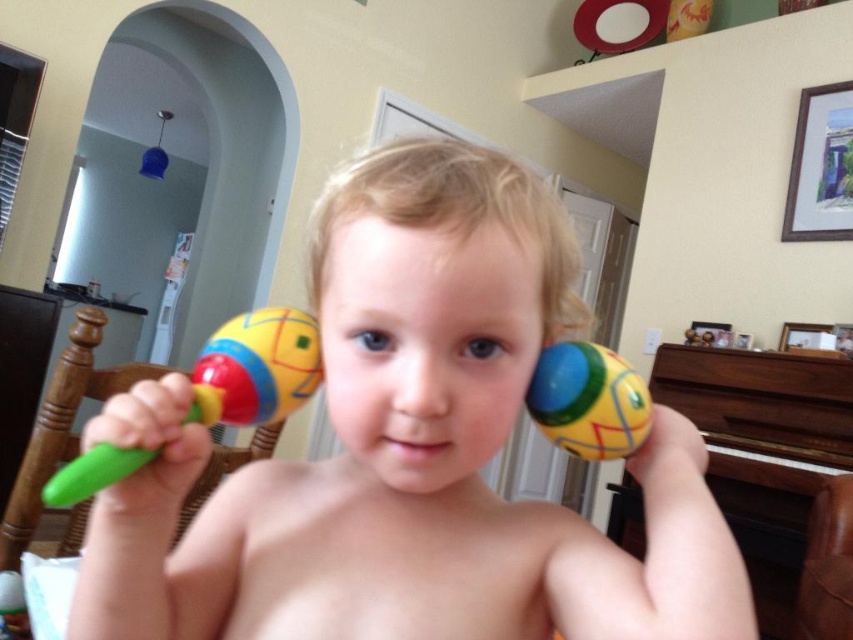
Does matte plastic maraca at left appear on the left side of matte plastic maraca at right?

Yes, matte plastic maraca at left is to the left of matte plastic maraca at right.

Which is above, matte plastic maraca at left or matte plastic maraca at right?

matte plastic maraca at right is above.

Is point (299, 339) closer to viewer compared to point (589, 396)?

No, (299, 339) is behind (589, 396).

I want to click on matte plastic maraca at left, so click(256, 369).

Which is in front, point (442, 515) or point (635, 440)?

Point (635, 440) is more forward.

Is point (648, 636) behind point (585, 376)?

That is False.

Find the location of a particular element. The image size is (853, 640). matte plastic maracas at center is located at coordinates (408, 451).

Does matte plastic maracas at center appear over matte plastic maraca at left?

Correct, matte plastic maracas at center is located above matte plastic maraca at left.

Is matte plastic maracas at center bigger than matte plastic maraca at left?

Yes, matte plastic maracas at center is bigger than matte plastic maraca at left.

Measure the distance between matte plastic maracas at center and camera.

A distance of 11.15 inches exists between matte plastic maracas at center and camera.

You are a GUI agent. You are given a task and a screenshot of the screen. Output one action in this format:
    pyautogui.click(x=<x>, y=<y>)
    Task: Click on the matte plastic maracas at center
    This screenshot has height=640, width=853.
    Given the screenshot: What is the action you would take?
    pyautogui.click(x=408, y=451)